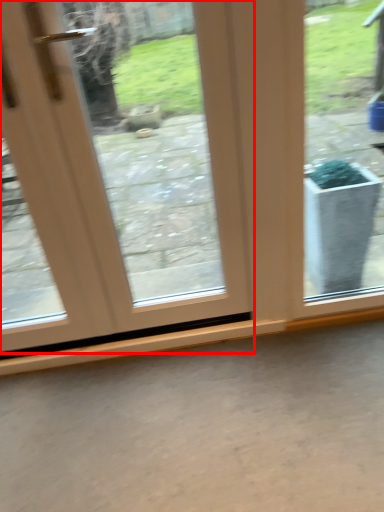
Question: Observing the image, what is the correct spatial positioning of door (annotated by the red box) in reference to concrete?

Choices:
 (A) right
 (B) left

Answer: (B)